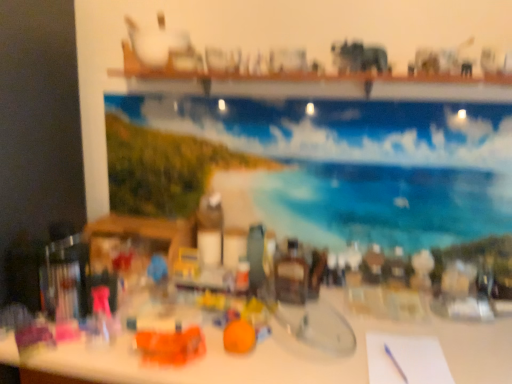
Where is `free point to the right of orange plastic toy at center, placed as the first toy when sorted from left to right`? free point to the right of orange plastic toy at center, placed as the first toy when sorted from left to right is located at coordinates (237, 358).